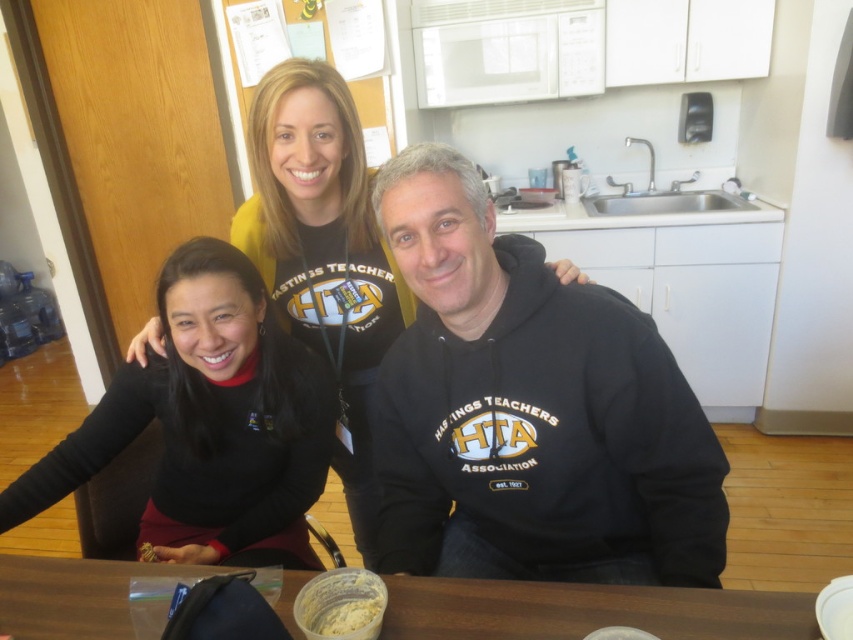
Who is positioned more to the right, brown wooden table at lower center or white creamy paste at lower center?

From the viewer's perspective, brown wooden table at lower center appears more on the right side.

Does point (473, 637) come farther from viewer compared to point (328, 602)?

No, (473, 637) is in front of (328, 602).

The height and width of the screenshot is (640, 853). Identify the location of brown wooden table at lower center. coord(587,611).

Who is lower down, black matte shirt at center or brown wooden table at lower center?

brown wooden table at lower center

Does black matte shirt at center appear over brown wooden table at lower center?

Yes, black matte shirt at center is above brown wooden table at lower center.

Is point (235, 224) positioned after point (451, 592)?

That is True.

Identify the location of black matte shirt at center. (323, 248).

Does black matte sweater at lower left appear under white creamy paste at lower center?

No.

Is black matte sweater at lower left further to the viewer compared to white creamy paste at lower center?

Yes, it is behind white creamy paste at lower center.

Between point (21, 518) and point (347, 604), which one is positioned behind?

Point (21, 518)

Find the location of a particular element. This screenshot has width=853, height=640. black matte sweater at lower left is located at coordinates (207, 419).